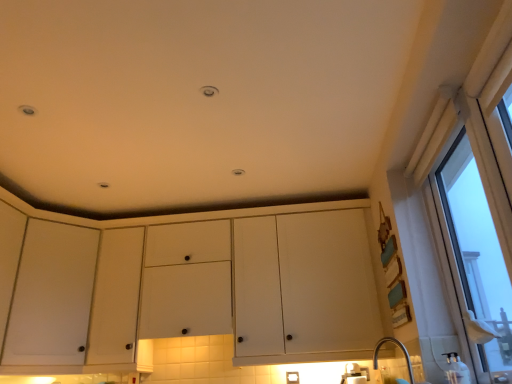
Question: From the image's perspective, is clear glass window at right beneath white matte cabinet at left?

Choices:
 (A) no
 (B) yes

Answer: (A)

Question: Is clear glass window at right not inside white matte cabinet at left?

Choices:
 (A) yes
 (B) no

Answer: (A)

Question: Is clear glass window at right closer to camera compared to white matte cabinet at left?

Choices:
 (A) no
 (B) yes

Answer: (B)

Question: Considering the relative positions of clear glass window at right and white matte cabinet at left in the image provided, is clear glass window at right to the left of white matte cabinet at left from the viewer's perspective?

Choices:
 (A) no
 (B) yes

Answer: (A)

Question: Is clear glass window at right looking in the opposite direction of white matte cabinet at left?

Choices:
 (A) no
 (B) yes

Answer: (A)

Question: Can you confirm if clear glass window at right is smaller than white matte cabinet at left?

Choices:
 (A) no
 (B) yes

Answer: (A)

Question: Does white matte cabinet at left appear on the right side of clear glass window at right?

Choices:
 (A) yes
 (B) no

Answer: (B)

Question: Considering the relative sizes of white matte cabinet at left and clear glass window at right in the image provided, is white matte cabinet at left shorter than clear glass window at right?

Choices:
 (A) no
 (B) yes

Answer: (B)

Question: Would you consider white matte cabinet at left to be distant from clear glass window at right?

Choices:
 (A) no
 (B) yes

Answer: (B)

Question: From a real-world perspective, is white matte cabinet at left on top of clear glass window at right?

Choices:
 (A) no
 (B) yes

Answer: (B)

Question: Is white matte cabinet at left positioned in front of clear glass window at right?

Choices:
 (A) yes
 (B) no

Answer: (B)

Question: Is clear glass window at right located within white matte cabinet at left?

Choices:
 (A) yes
 (B) no

Answer: (B)

Question: Is clear glass window at right wider than white matte cabinet at center?

Choices:
 (A) yes
 (B) no

Answer: (B)